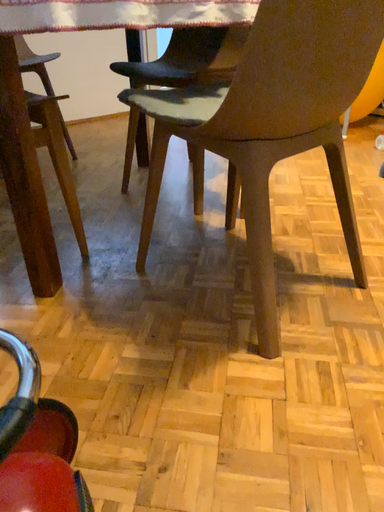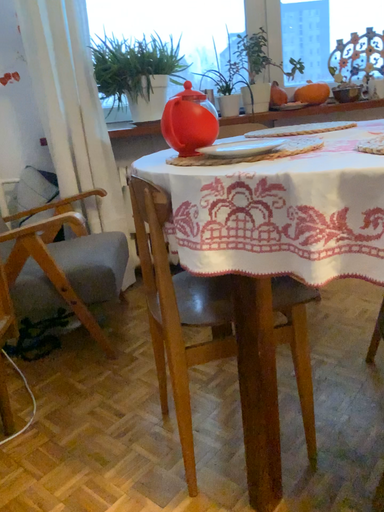
Question: How did the camera likely rotate when shooting the video?

Choices:
 (A) rotated upward
 (B) rotated downward

Answer: (A)